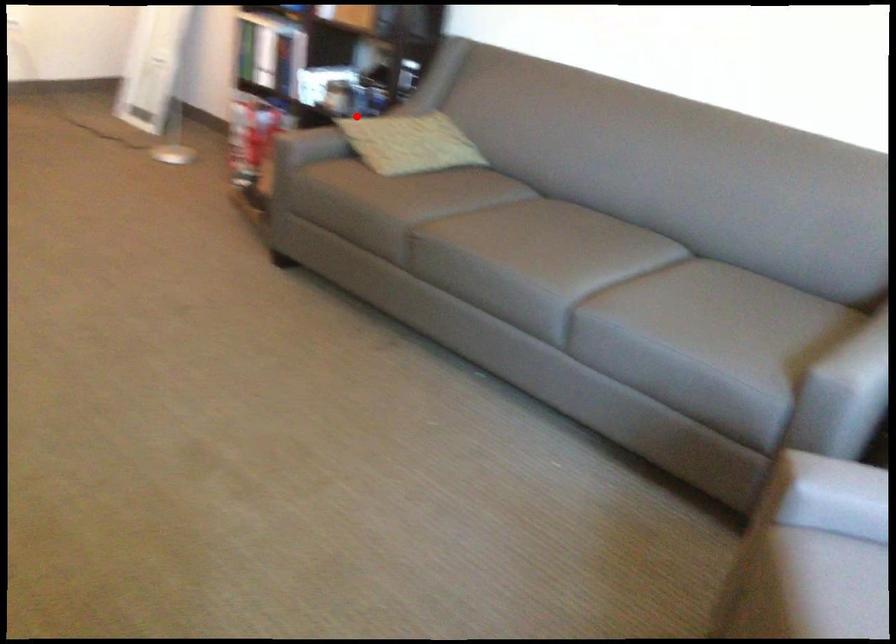
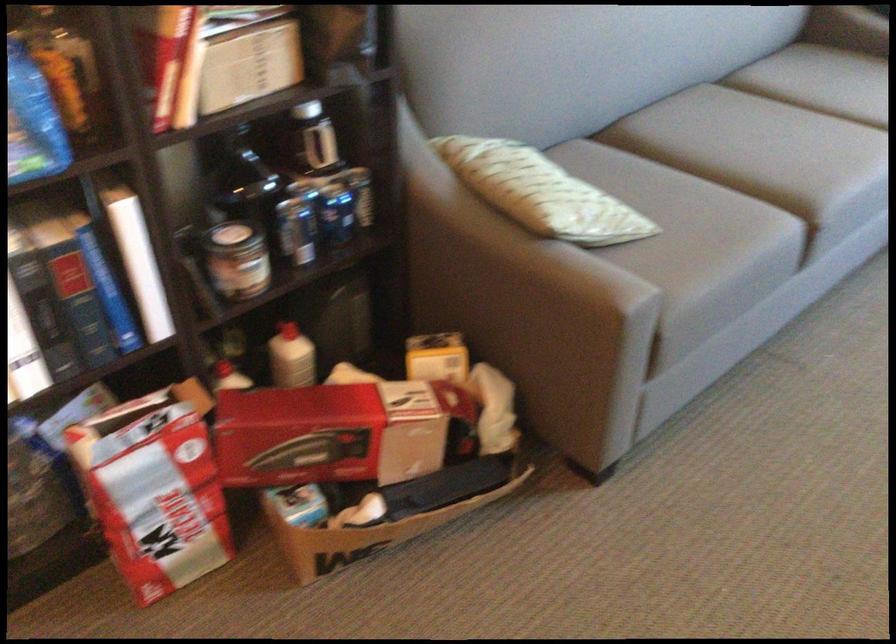
In the second image, find the point that corresponds to the highlighted location in the first image.

(537, 192)